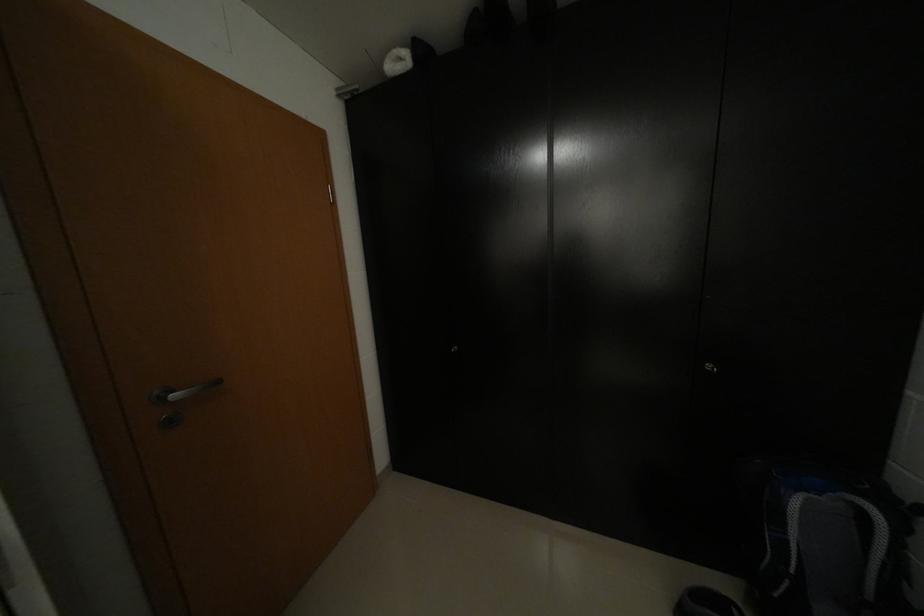
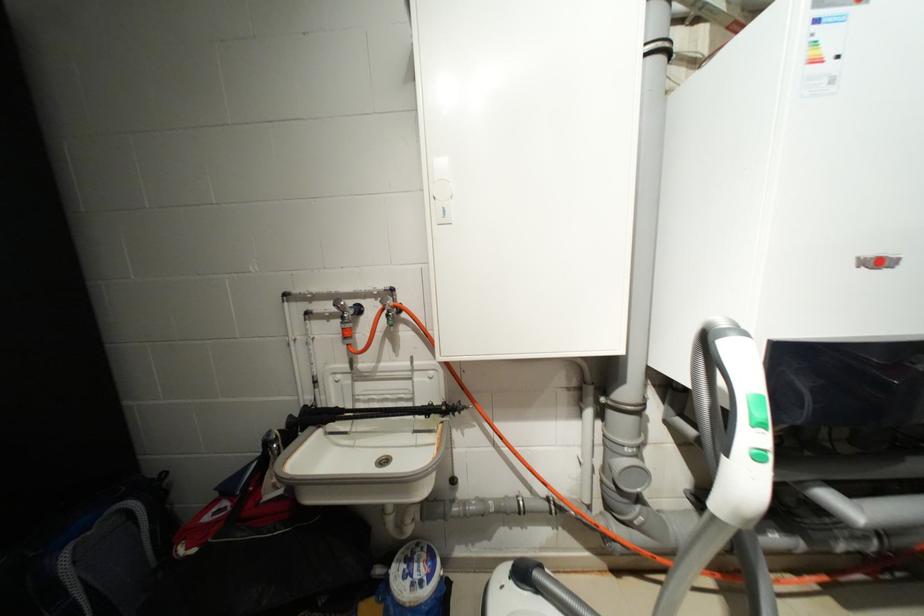
Question: The camera is either moving clockwise (left) or counter-clockwise (right) around the object. The first image is from the beginning of the video and the second image is from the end. Is the camera moving left or right when shooting the video?

Choices:
 (A) Left
 (B) Right

Answer: (A)